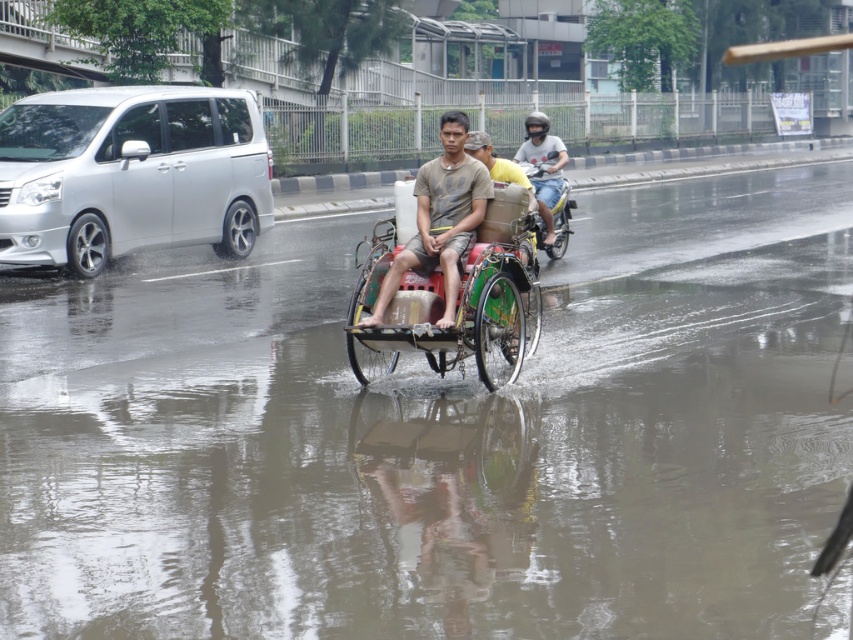
Question: Which of the following is the closest to the observer?

Choices:
 (A) (531, 152)
 (B) (467, 205)
 (C) (517, 260)

Answer: (B)

Question: Is green matte cart at center in front of matte black helmet at upper center?

Choices:
 (A) no
 (B) yes

Answer: (B)

Question: Observing the image, what is the correct spatial positioning of green matte cart at center in reference to matte black helmet at upper center?

Choices:
 (A) left
 (B) right

Answer: (A)

Question: Considering the relative positions of green matte cart at center and matte black helmet at upper center in the image provided, where is green matte cart at center located with respect to matte black helmet at upper center?

Choices:
 (A) right
 (B) left

Answer: (B)

Question: Which object is closer to the camera taking this photo?

Choices:
 (A) matte black helmet at upper center
 (B) silver metallic van at left

Answer: (A)

Question: Estimate the real-world distances between objects in this image. Which object is farther from the brown fabric tricycle at center?

Choices:
 (A) green matte cart at center
 (B) silver metallic van at left

Answer: (B)